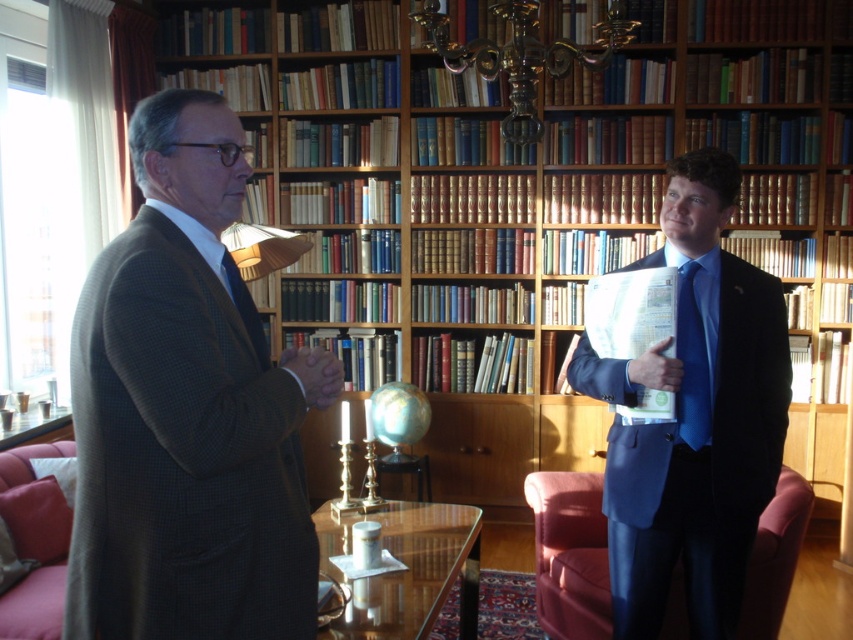
Question: Does wooden bookshelf at center appear on the left side of matte black tie at center?

Choices:
 (A) yes
 (B) no

Answer: (B)

Question: Which object is farther from the camera taking this photo?

Choices:
 (A) matte brown suit at left
 (B) wooden bookshelf at center
 (C) blue glossy suit at center

Answer: (B)

Question: Does velvet red armchair at lower left have a greater width compared to blue silk tie at right?

Choices:
 (A) yes
 (B) no

Answer: (A)

Question: Which object is farther from the camera taking this photo?

Choices:
 (A) matte black tie at center
 (B) wooden bookshelf at center
 (C) blue silk tie at right
 (D) blue glossy suit at center

Answer: (B)

Question: Is wooden bookshelf at center to the right of matte brown suit at left from the viewer's perspective?

Choices:
 (A) no
 (B) yes

Answer: (B)

Question: Which point is farther from the camera taking this photo?

Choices:
 (A) (235, 269)
 (B) (50, 449)

Answer: (B)